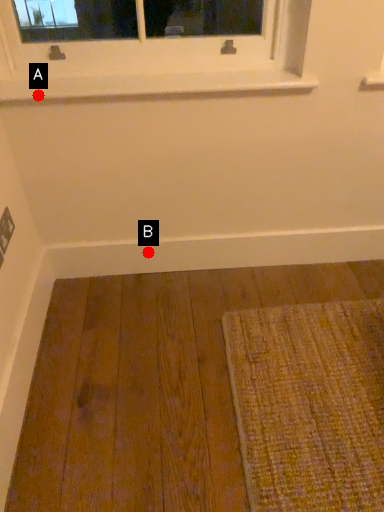
Question: Two points are circled on the image, labeled by A and B beside each circle. Among these points, which one is nearest to the camera?

Choices:
 (A) A is closer
 (B) B is closer

Answer: (A)